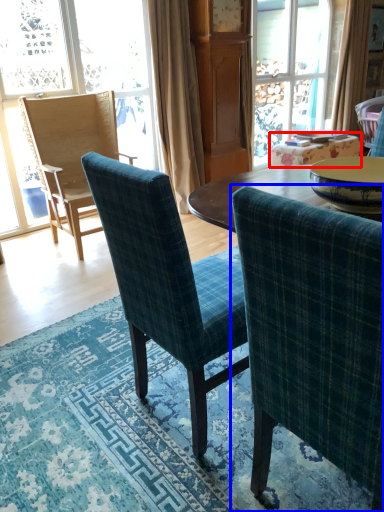
Question: Which object appears farthest to the camera in this image, table (highlighted by a red box) or chair (highlighted by a blue box)?

Choices:
 (A) table
 (B) chair

Answer: (A)